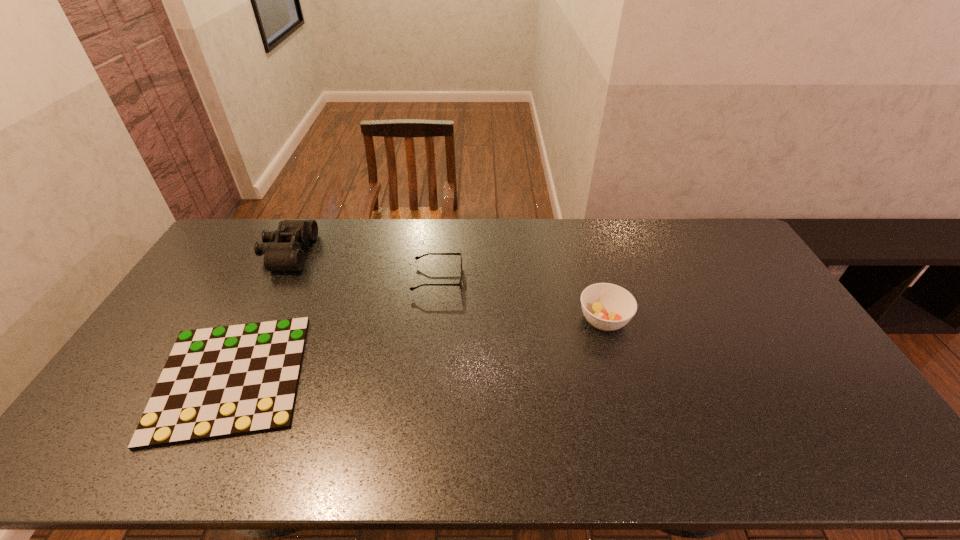
Where is `binoculars`? Image resolution: width=960 pixels, height=540 pixels. binoculars is located at coordinates (282, 249).

In order to click on soup bowl in this screenshot , I will do `click(606, 306)`.

You are a GUI agent. You are given a task and a screenshot of the screen. Output one action in this format:
    pyautogui.click(x=<x>, y=<y>)
    Task: Click on the second tallest object
    The height and width of the screenshot is (540, 960).
    Given the screenshot: What is the action you would take?
    pyautogui.click(x=606, y=306)

In order to click on the third object from left to right in this screenshot , I will do `click(459, 284)`.

Image resolution: width=960 pixels, height=540 pixels. What are the coordinates of `the third tallest object` in the screenshot? It's located at (459, 284).

Find the location of a particular element. The height and width of the screenshot is (540, 960). the shortest object is located at coordinates (218, 382).

Where is `blank space located at the eyepieces of the binoculars`? blank space located at the eyepieces of the binoculars is located at coordinates (379, 253).

Where is `free space located 0.070m on the right of the soup bowl`? free space located 0.070m on the right of the soup bowl is located at coordinates (653, 320).

Locate an element on the screen. Image resolution: width=960 pixels, height=540 pixels. vacant space located on the front lenses of the sunglasses is located at coordinates (497, 279).

Identify the location of free space located on the back of the shortest object. The image size is (960, 540). (271, 297).